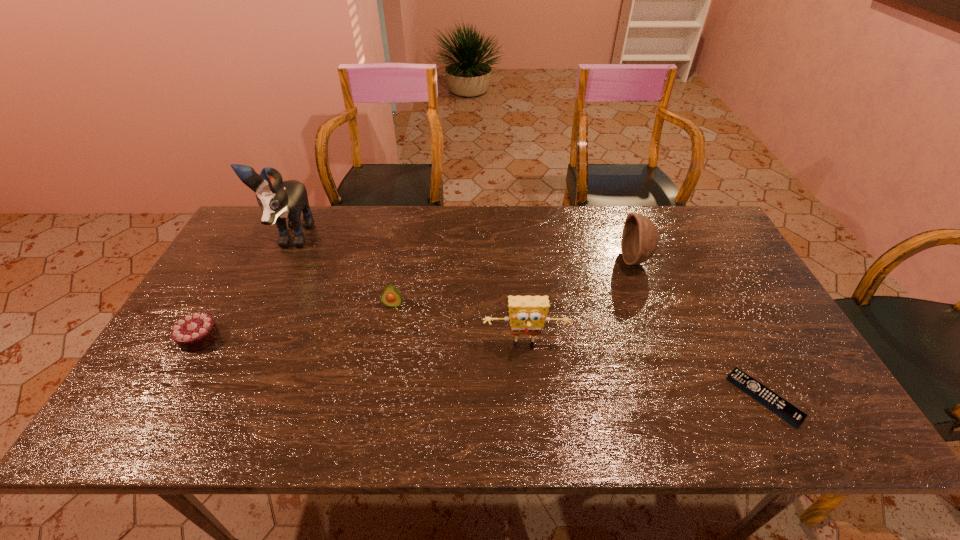
Locate an element on the screen. The height and width of the screenshot is (540, 960). vacant space at the near right corner of the desktop is located at coordinates (828, 416).

This screenshot has width=960, height=540. I want to click on free space between the shortest object and the second object from right to left, so click(x=700, y=329).

At what (x,y) coordinates should I click in order to perform the action: click on vacant region between the chocolate cake and the remote control. Please return your answer as a coordinate pair (x, y). This screenshot has height=540, width=960. Looking at the image, I should click on (482, 368).

The image size is (960, 540). I want to click on vacant area between the fifth object from left to right and the third shortest object, so click(515, 282).

This screenshot has width=960, height=540. I want to click on free space between the bowl and the puppy, so click(464, 249).

Locate an element on the screen. vacant space that's between the chocolate cake and the nearest object is located at coordinates [482, 368].

At what (x,y) coordinates should I click in order to perform the action: click on free space that is in between the leftmost object and the sponge. Please return your answer as a coordinate pair (x, y). Looking at the image, I should click on (362, 342).

The height and width of the screenshot is (540, 960). What are the coordinates of `free spot between the tallest object and the second shortest object` in the screenshot? It's located at (246, 288).

Identify the location of unoccupied area between the fourth object from left to right and the fourth tallest object. The image size is (960, 540). (459, 325).

Locate an element on the screen. vacant space that's between the fifth object from left to right and the rightmost object is located at coordinates (700, 329).